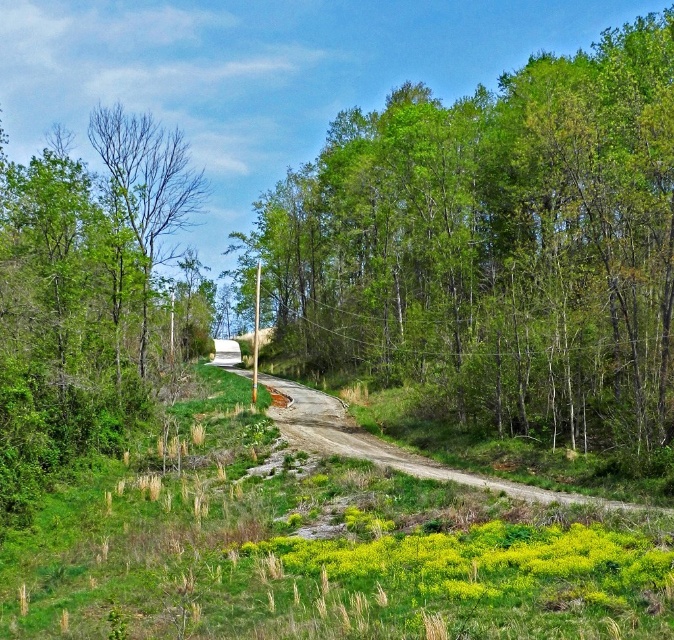
Question: Which object appears closest to the camera in this image?

Choices:
 (A) bare branches at left
 (B) green leafy tree at center
 (C) green leafy tree at left

Answer: (C)

Question: Is bare branches at left behind dirt/gravel path at center?

Choices:
 (A) yes
 (B) no

Answer: (A)

Question: Among these objects, which one is nearest to the camera?

Choices:
 (A) dirt/gravel path at center
 (B) bare branches at left
 (C) green leafy tree at left

Answer: (A)

Question: Is green leafy tree at center positioned behind dirt/gravel path at center?

Choices:
 (A) yes
 (B) no

Answer: (A)

Question: Which of the following is the closest to the observer?

Choices:
 (A) (454, 336)
 (B) (96, 129)

Answer: (A)

Question: Does green leafy tree at left appear on the left side of bare branches at left?

Choices:
 (A) yes
 (B) no

Answer: (A)